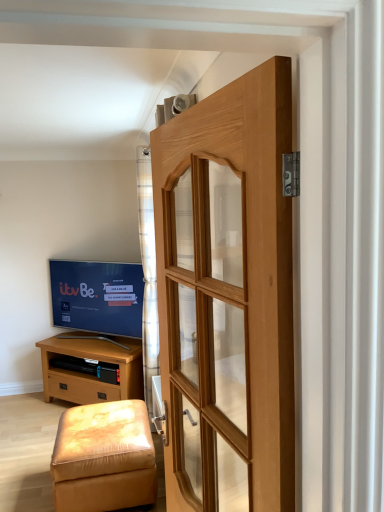
Question: In the image, is plaid fabric curtain at center positioned in front of or behind natural wood door at center?

Choices:
 (A) front
 (B) behind

Answer: (B)

Question: In terms of height, does plaid fabric curtain at center look taller or shorter compared to natural wood door at center?

Choices:
 (A) tall
 (B) short

Answer: (A)

Question: Estimate the real-world distances between objects in this image. Which object is closer to the matte black tv at left?

Choices:
 (A) light brown wood chest of drawers at lower left
 (B) leather-like beige stool at lower left
 (C) natural wood door at center
 (D) plaid fabric curtain at center

Answer: (A)

Question: Considering the real-world distances, which object is closest to the leather-like beige stool at lower left?

Choices:
 (A) plaid fabric curtain at center
 (B) light brown wood chest of drawers at lower left
 (C) natural wood door at center
 (D) matte black tv at left

Answer: (A)